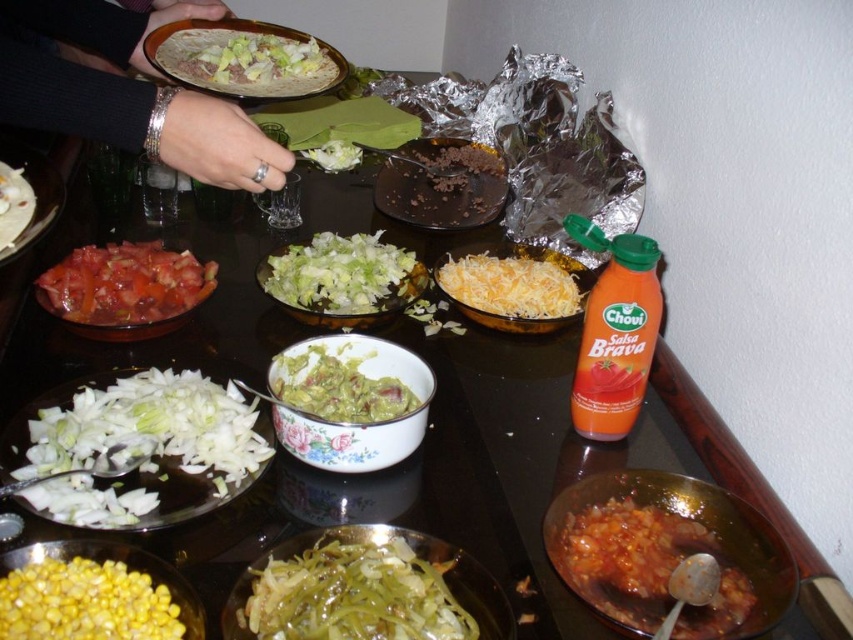
You are standing at the edge of the table and need to reach two points to retrieve ingredients. The first point is at coordinates point [416,611] and the second is at point [180,61]. Which point is closer to you?

Point [180,61] is closer to you because it is behind point [416,611], which is in front.

You are a chef arranging ingredients on a table for a taco bar. You have a shiny silver taco at upper center and white shredded lettuce at center. Where should you place a new bowl of salsa so that it is between the two items?

The salsa bowl should be placed between the shiny silver taco at upper center and the white shredded lettuce at center. Since the shiny silver taco at upper center is in front of the white shredded lettuce at center, positioning the salsa bowl in between them would logically place it closer to the taco but still between the two items.

Looking at this image, you are a chef preparing a taco and need to know the height of the ingredients. Which object is taller, the shiny silver taco at upper center or the white shredded lettuce at center?

The shiny silver taco at upper center is much taller than the white shredded lettuce at center.